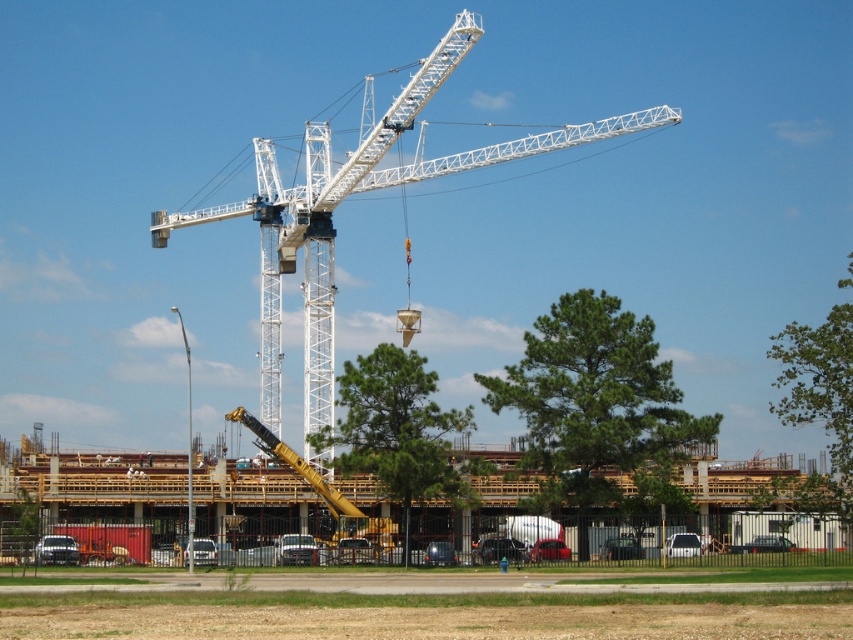
You are a construction worker standing at the base of the crane and looking towards the fence. You see two points marked on the crane structure at point coordinates point (347, 532) and point (195, 540). Which point is closer to you?

Point (347, 532) is further to the viewer than point (195, 540), so the point closer to you is point (195, 540).

You are a delivery driver who needs to park your truck, which is 10 meters long, between the yellow metallic crane at center and the matte black truck at lower left. Is there enough space between them for your truck?

The yellow metallic crane at center and the matte black truck at lower left are 27.77 meters apart, so yes, the delivery driver can park their 10 meter long truck between them since the space is sufficient.

You are a construction worker standing at the camera position. You need to reach the wooden frame at center to inspect it. Can you walk directly to it without any obstacles?

The wooden frame at center is 148.83 meters away from the camera, so you can walk directly to it without any obstacles because there are no mentioned obstacles between you and the wooden frame at center in the scene description.